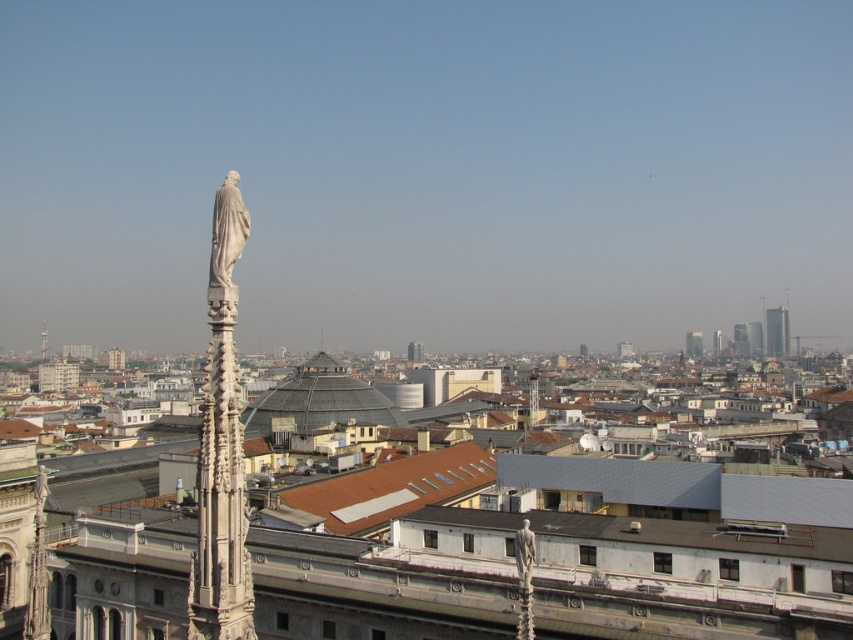
Who is taller, smooth glass skyscraper at right or white stone spire at left?

With more height is smooth glass skyscraper at right.

The height and width of the screenshot is (640, 853). Find the location of `smooth glass skyscraper at right`. smooth glass skyscraper at right is located at coordinates (776, 332).

Where is `smooth glass skyscraper at right`? The height and width of the screenshot is (640, 853). smooth glass skyscraper at right is located at coordinates (776, 332).

Between white marble statue at left and matte gray tower at center, which one appears on the left side from the viewer's perspective?

From the viewer's perspective, white marble statue at left appears more on the left side.

Where is `white marble statue at left`? This screenshot has height=640, width=853. white marble statue at left is located at coordinates (221, 445).

Between white marble statue at left and smooth glass skyscraper at right, which one is positioned higher?

white marble statue at left is above.

Does white marble statue at left appear on the right side of smooth glass skyscraper at right?

Incorrect, white marble statue at left is not on the right side of smooth glass skyscraper at right.

Is point (224, 269) behind point (770, 339)?

No, (224, 269) is closer to viewer.

Locate an element on the screen. white marble statue at left is located at coordinates (221, 445).